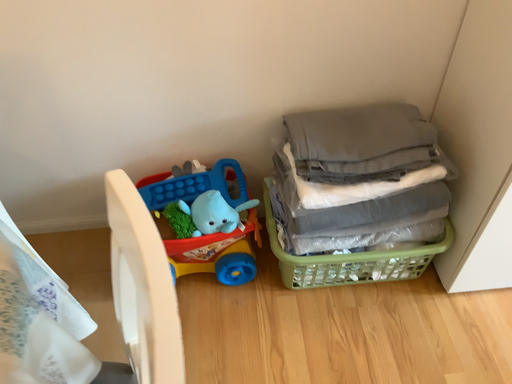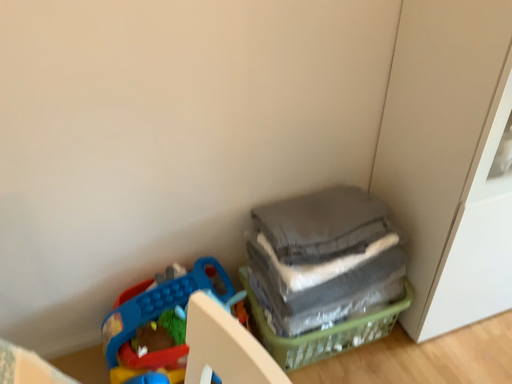
Question: How did the camera likely rotate when shooting the video?

Choices:
 (A) rotated left
 (B) rotated right

Answer: (B)